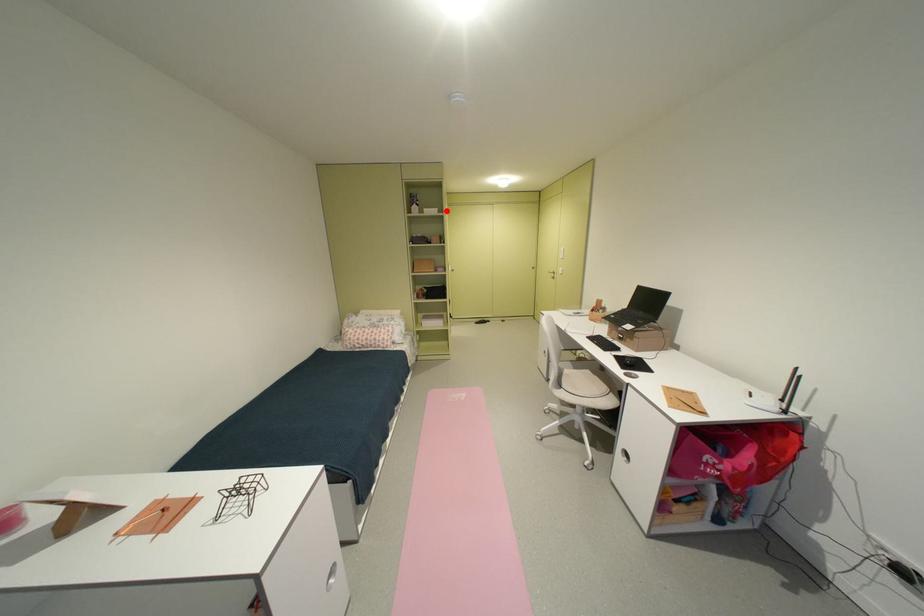
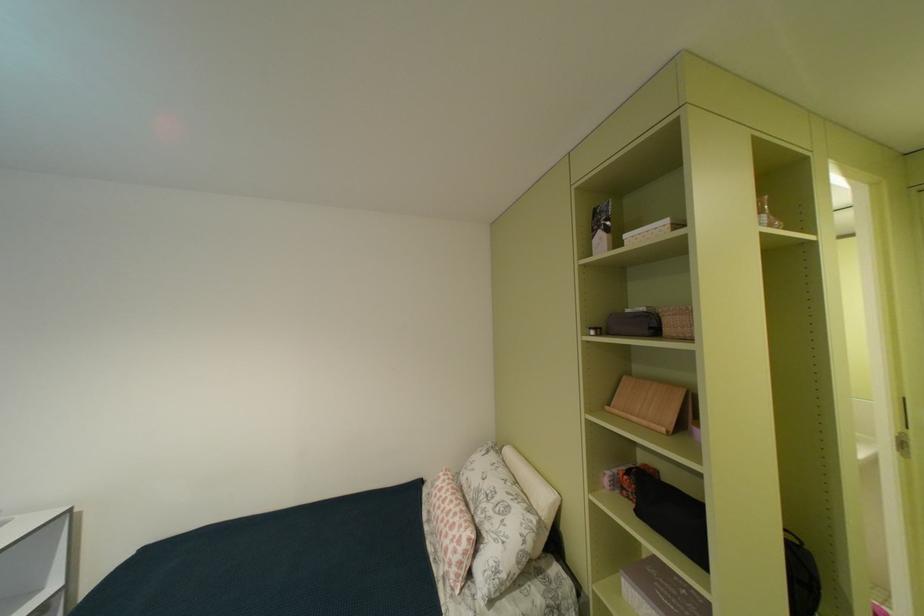
Question: A red point is marked in image1. In image2, is the corresponding 3D point closer to the camera or farther? Reply with the corresponding letter.

Choices:
 (A) The corresponding 3D point is closer.
 (B) The corresponding 3D point is farther.

Answer: (B)